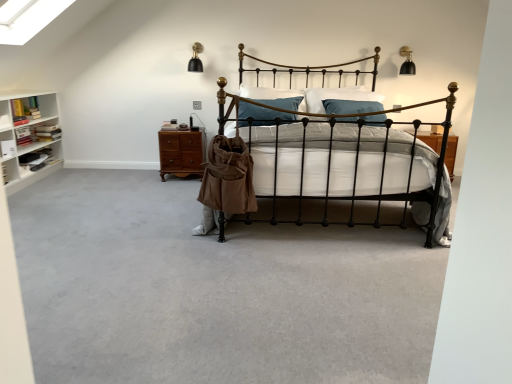
Identify the location of vacant area that lies in front of black wrought iron bed at center. (290, 292).